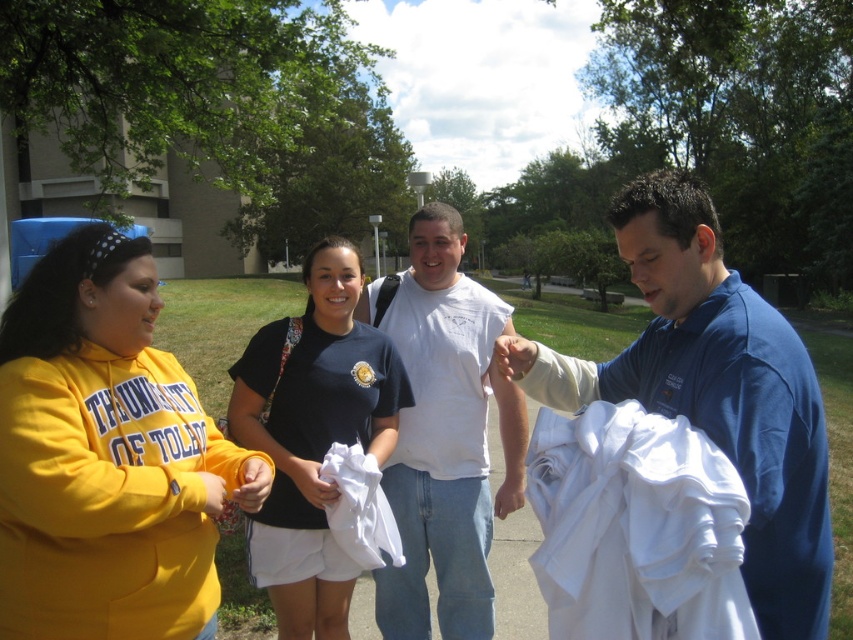
Who is lower down, yellow fleece sweatshirt at left or white cotton t-shirt at center?

white cotton t-shirt at center

Can you confirm if yellow fleece sweatshirt at left is positioned above white cotton t-shirt at center?

Yes.

This screenshot has width=853, height=640. Describe the element at coordinates (106, 456) in the screenshot. I see `yellow fleece sweatshirt at left` at that location.

I want to click on yellow fleece sweatshirt at left, so click(x=106, y=456).

Which of these two, yellow fleece sweatshirt at left or navy blue t-shirt at center, stands shorter?

With less height is yellow fleece sweatshirt at left.

Is yellow fleece sweatshirt at left taller than navy blue t-shirt at center?

Incorrect, yellow fleece sweatshirt at left's height is not larger of navy blue t-shirt at center's.

I want to click on yellow fleece sweatshirt at left, so click(x=106, y=456).

Can you confirm if white cotton t-shirt at center is positioned below navy blue t-shirt at center?

Actually, white cotton t-shirt at center is above navy blue t-shirt at center.

Who is positioned more to the left, white cotton t-shirt at center or navy blue t-shirt at center?

From the viewer's perspective, navy blue t-shirt at center appears more on the left side.

You are a GUI agent. You are given a task and a screenshot of the screen. Output one action in this format:
    pyautogui.click(x=<x>, y=<y>)
    Task: Click on the white cotton t-shirt at center
    The width and height of the screenshot is (853, 640).
    Given the screenshot: What is the action you would take?
    pyautogui.click(x=444, y=433)